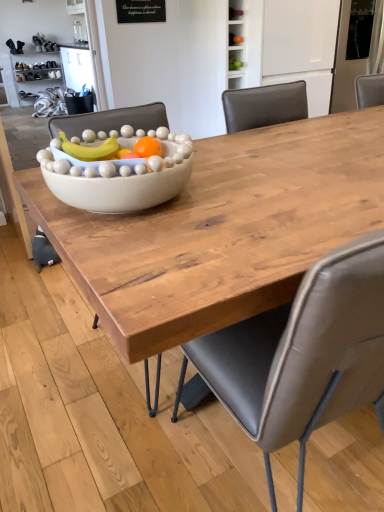
In order to click on matte wood bowl at center in this screenshot , I will do `click(222, 229)`.

What do you see at coordinates (119, 189) in the screenshot? Image resolution: width=384 pixels, height=512 pixels. I see `white glossy bowl at center` at bounding box center [119, 189].

This screenshot has height=512, width=384. I want to click on matte wood bowl at center, so click(222, 229).

Can you confirm if white glossy bowl at center is shorter than matte wood bowl at center?

Indeed, white glossy bowl at center has a lesser height compared to matte wood bowl at center.

Are white glossy bowl at center and matte wood bowl at center beside each other?

No, white glossy bowl at center is not beside matte wood bowl at center.

From the image's perspective, who appears lower, gray leather chair at center or white glossy bowl at center?

gray leather chair at center.

Is point (258, 423) positioned before point (59, 150)?

Yes.

Is gray leather chair at center far from white glossy bowl at center?

gray leather chair at center is near white glossy bowl at center, not far away.

Does gray leather chair at center have a greater width compared to white glossy bowl at center?

Yes.

Which of these two, matte wood bowl at center or white glossy bowl at center, is thinner?

white glossy bowl at center.

Is matte wood bowl at center taller or shorter than white glossy bowl at center?

matte wood bowl at center is taller than white glossy bowl at center.

Does point (220, 180) come in front of point (121, 142)?

No, (220, 180) is behind (121, 142).

How different are the orientations of white glossy bowl at center and gray leather chair at center in degrees?

The angular difference between white glossy bowl at center and gray leather chair at center is 88.2 degrees.

Are white glossy bowl at center and gray leather chair at center making contact?

They are not placed beside each other.

Considering the sizes of white glossy bowl at center and gray leather chair at center in the image, is white glossy bowl at center bigger or smaller than gray leather chair at center?

In the image, white glossy bowl at center appears to be smaller than gray leather chair at center.

Is white glossy bowl at center taller or shorter than gray leather chair at center?

Considering their sizes, white glossy bowl at center has less height than gray leather chair at center.

Is point (361, 352) positioned after point (357, 219)?

No, it is in front of (357, 219).

Consider the image. Is gray leather chair at center far from matte wood bowl at center?

They are positioned close to each other.

From a real-world perspective, is gray leather chair at center located higher than matte wood bowl at center?

Yes, from a real-world perspective, gray leather chair at center is above matte wood bowl at center.

Looking at this image, considering the positions of objects gray leather chair at center and matte wood bowl at center in the image provided, who is more to the right, gray leather chair at center or matte wood bowl at center?

From the viewer's perspective, matte wood bowl at center appears more on the right side.

In the image, is matte wood bowl at center positioned in front of or behind gray leather chair at center?

Clearly, matte wood bowl at center is behind gray leather chair at center.

From a real-world perspective, who is located higher, matte wood bowl at center or gray leather chair at center?

gray leather chair at center, from a real-world perspective.

Are matte wood bowl at center and gray leather chair at center located far from each other?

matte wood bowl at center is actually quite close to gray leather chair at center.

Identify the location of bowl above the matte wood bowl at center (from the image's perspective). (119, 189).

Identify the location of chair located underneath the white glossy bowl at center (from a real-world perspective). (303, 355).

Which object lies further to the anchor point white glossy bowl at center, gray leather chair at center or matte wood bowl at center?

gray leather chair at center is further to white glossy bowl at center.

Based on their spatial positions, is white glossy bowl at center or matte wood bowl at center closer to gray leather chair at center?

The object closer to gray leather chair at center is matte wood bowl at center.

When comparing their distances from white glossy bowl at center, does matte wood bowl at center or gray leather chair at center seem further?

gray leather chair at center is further to white glossy bowl at center.

Looking at this image, which object lies further to the anchor point matte wood bowl at center, gray leather chair at center or white glossy bowl at center?

Among the two, gray leather chair at center is located further to matte wood bowl at center.

From the image, which object appears to be nearer to matte wood bowl at center, white glossy bowl at center or gray leather chair at center?

white glossy bowl at center.

Based on their spatial positions, is matte wood bowl at center or white glossy bowl at center closer to gray leather chair at center?

matte wood bowl at center lies closer to gray leather chair at center than the other object.

Identify the location of chair situated between white glossy bowl at center and matte wood bowl at center from left to right. (303, 355).